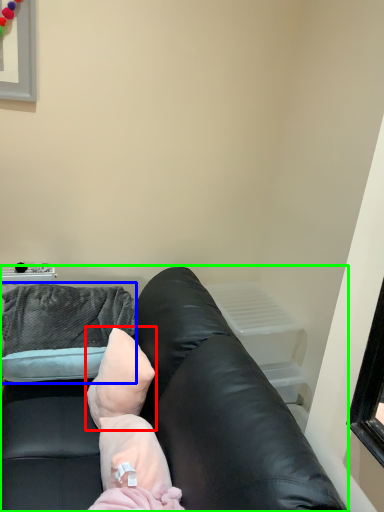
Question: Which object is the farthest from pillow (highlighted by a red box)? Choose among these: throw pillow (highlighted by a blue box) or studio couch (highlighted by a green box).

Choices:
 (A) throw pillow
 (B) studio couch

Answer: (A)